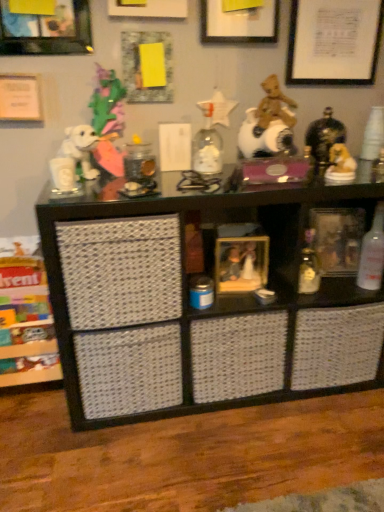
Question: From a real-world perspective, is wooden picture frame at center, marked as the 5th picture frame in a top-to-bottom arrangement, above or below matte white picture frame at upper center, marked as the third picture frame in a left-to-right arrangement?

Choices:
 (A) above
 (B) below

Answer: (B)

Question: Is wooden picture frame at center, positioned as the 4th picture frame in left-to-right order, bigger or smaller than matte white picture frame at upper center, acting as the 4th picture frame starting from the bottom?

Choices:
 (A) big
 (B) small

Answer: (A)

Question: Which object is the farthest from the matte white picture frame at upper center, the third picture frame from the right?

Choices:
 (A) white paper at upper center, arranged as the 4th picture frame when viewed from the right
 (B) brushed metal picture frame at upper left, which is counted as the 2th picture frame, starting from the bottom
 (C) white glossy horse at upper right, acting as the 2th toy starting from the top
 (D) translucent glass bottle at right, the first toy from the bottom
 (E) white matte picture frame at upper right, arranged as the fifth picture frame when viewed from the left

Answer: (D)

Question: Estimate the real-world distances between objects in this image. Which object is closer to the matte white picture frame at upper center, which is the 2th picture frame in top-to-bottom order?

Choices:
 (A) white paper at upper center, the 1th picture frame in the top-to-bottom sequence
 (B) shiny black vase at upper right, which is counted as the 3th toy, starting from the bottom
 (C) translucent glass bottle at right, which is the 3th toy in top-to-bottom order
 (D) clear glass bottle at right
 (E) brushed metal picture frame at upper left, the 1th picture frame when ordered from left to right

Answer: (A)